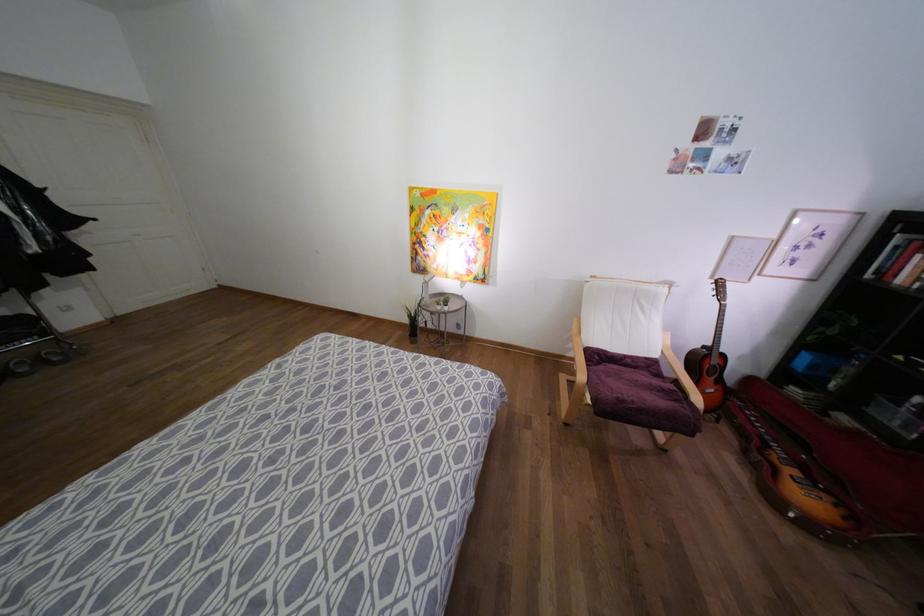
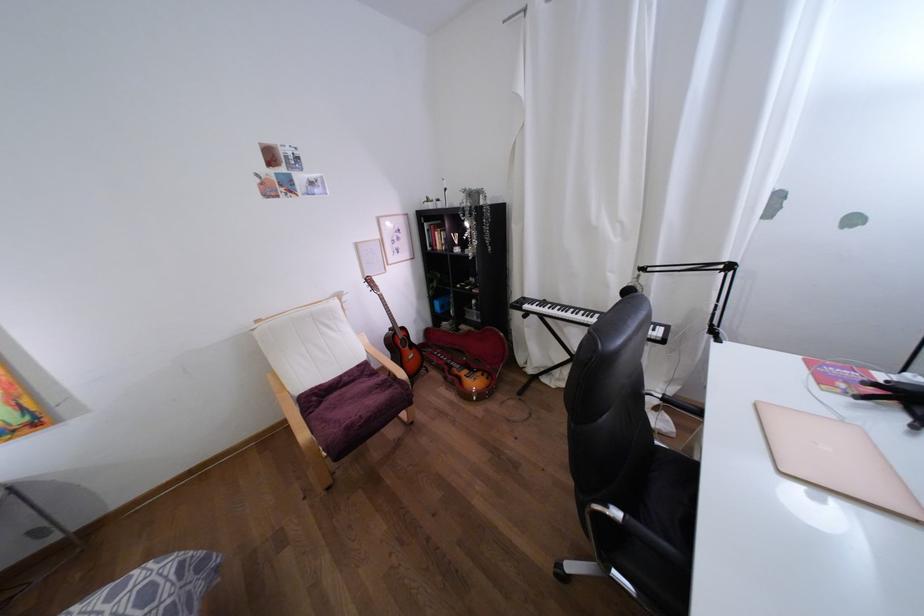
Find the pixel in the second image that matches (624,355) in the first image.

(339, 377)